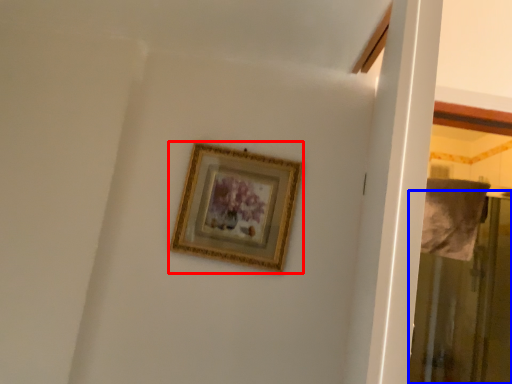
Question: Among these objects, which one is farthest to the camera, picture frame (highlighted by a red box) or screen door (highlighted by a blue box)?

Choices:
 (A) picture frame
 (B) screen door

Answer: (B)